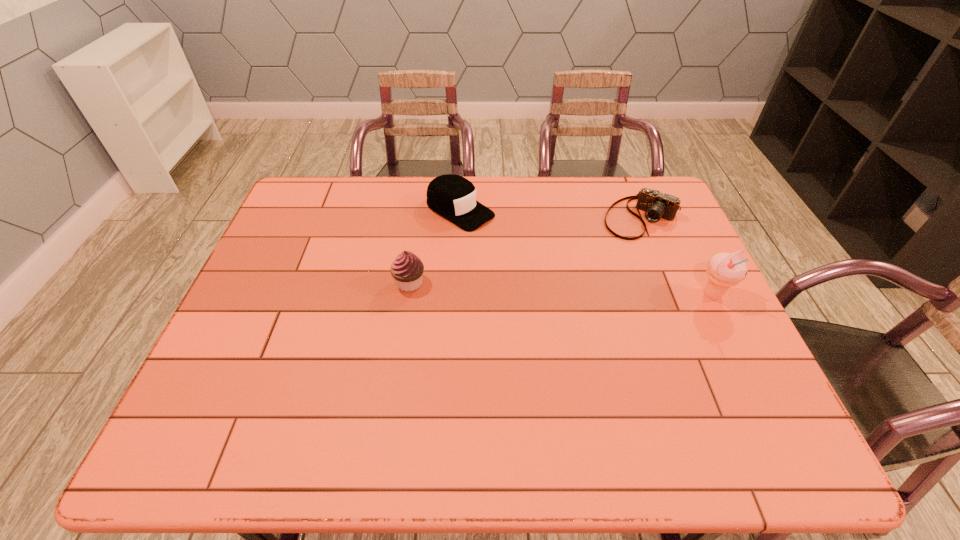
The image size is (960, 540). Identify the location of empty location between the icecream and the cupcake. (561, 289).

I want to click on empty location between the shortest object and the icecream, so click(x=677, y=256).

This screenshot has width=960, height=540. I want to click on empty space between the third tallest object and the icecream, so click(x=587, y=253).

What are the coordinates of `the closest object relative to the camera` in the screenshot? It's located at (724, 270).

Find the location of a particular element. The image size is (960, 540). object that is the second closest one to the shortest object is located at coordinates (453, 197).

This screenshot has width=960, height=540. Find the location of `vacant space that satisfies the following two spatial constraints: 1. on the back side of the shortest object; 2. on the left side of the third shortest object`. vacant space that satisfies the following two spatial constraints: 1. on the back side of the shortest object; 2. on the left side of the third shortest object is located at coordinates (420, 218).

At what (x,y) coordinates should I click in order to perform the action: click on free location that satisfies the following two spatial constraints: 1. on the front side of the second shortest object; 2. on the right side of the icecream. Please return your answer as a coordinate pair (x, y). This screenshot has height=540, width=960. Looking at the image, I should click on (456, 295).